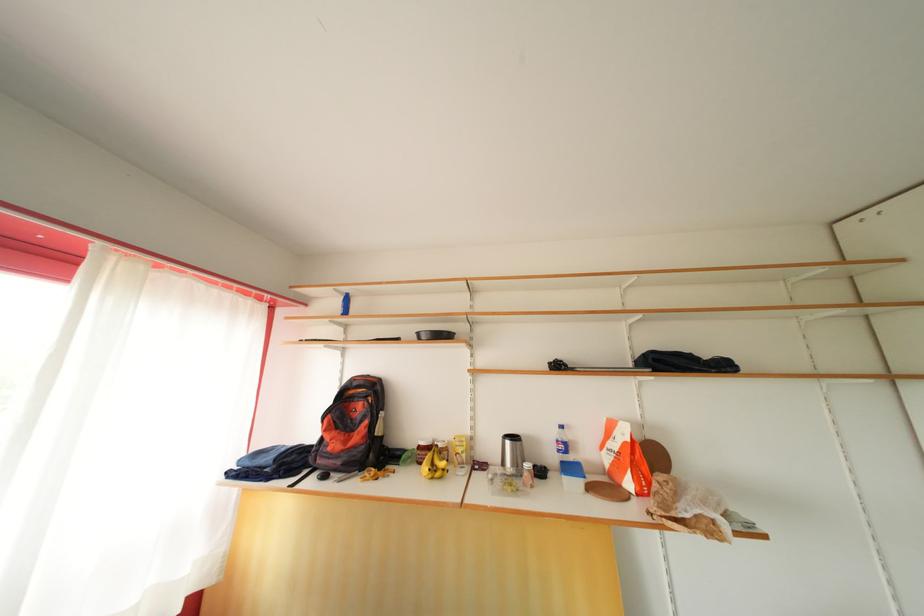
Find where to lift the silver thermos. Please return your answer as a coordinate pair (x, y).

(512, 453)